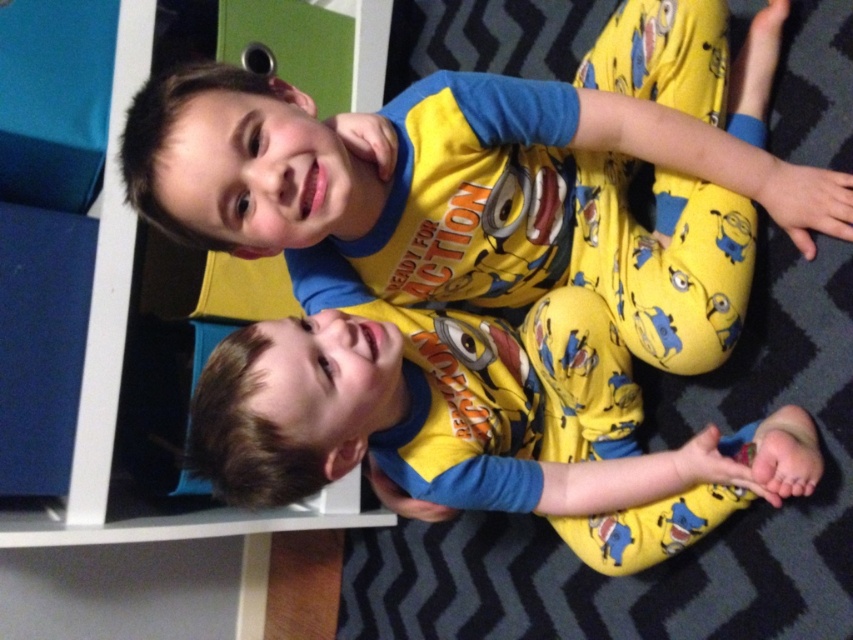
You are a parent trying to put away a new book that is 15 centimeters thick. The bookshelf has a width of 60 centimeters. Can the book fit on the shelf between the matte plastic bookshelf at upper left and the yellow cotton pajamas at lower center?

The distance between the matte plastic bookshelf at upper left and the yellow cotton pajamas at lower center is 72.07 centimeters. Since the book is only 15 centimeters thick, it can easily fit in the space between them.

You are a parent trying to decide whether to place a new toy on the shelf. The toy is as wide as the yellow cotton pajamas at lower center. Can the toy fit on the matte plastic bookshelf at upper left?

The matte plastic bookshelf at upper left is wider than the yellow cotton pajamas at lower center, so the toy can fit on the shelf since its width is equal to the pajamas and the shelf is wider.